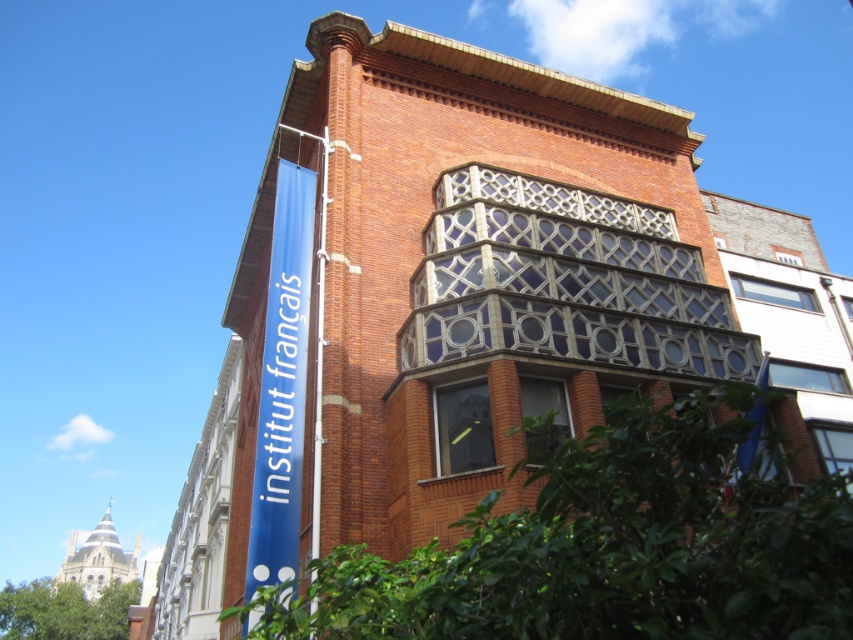
You are an architect analyzing the building facade. Which object between the blue fabric sign at left and the metallic silver pole at upper center is taller?

The blue fabric sign at left is taller than the metallic silver pole at upper center.

You are a window cleaner standing on the clear glass balcony at center. You need to reach the metallic silver pole at upper center to clean it. Can you reach it from your current position?

The clear glass balcony at center might be wider than metallic silver pole at upper center, so it is possible that the balcony extends far enough to allow the window cleaner to reach the metallic silver pole at upper center. However, without exact measurements, this is uncertain.